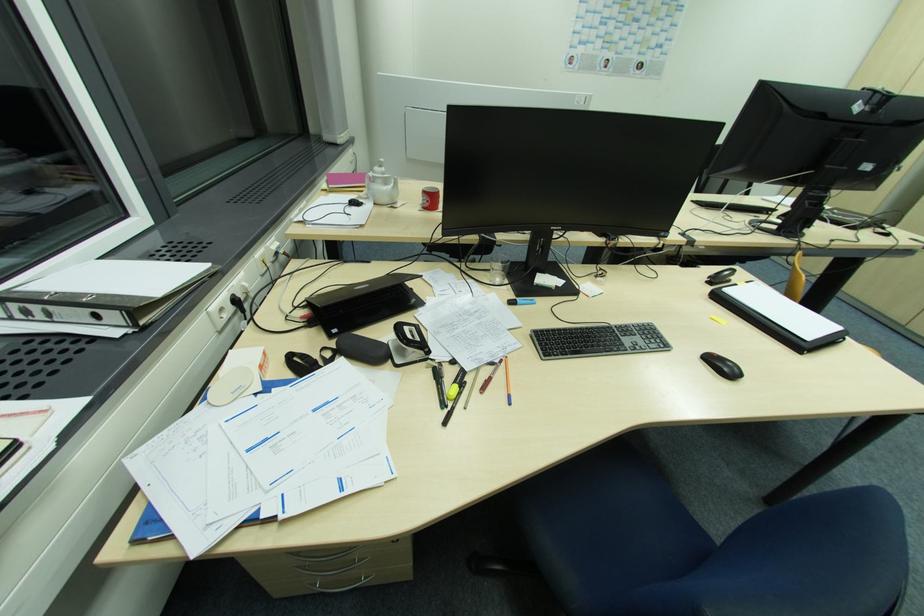
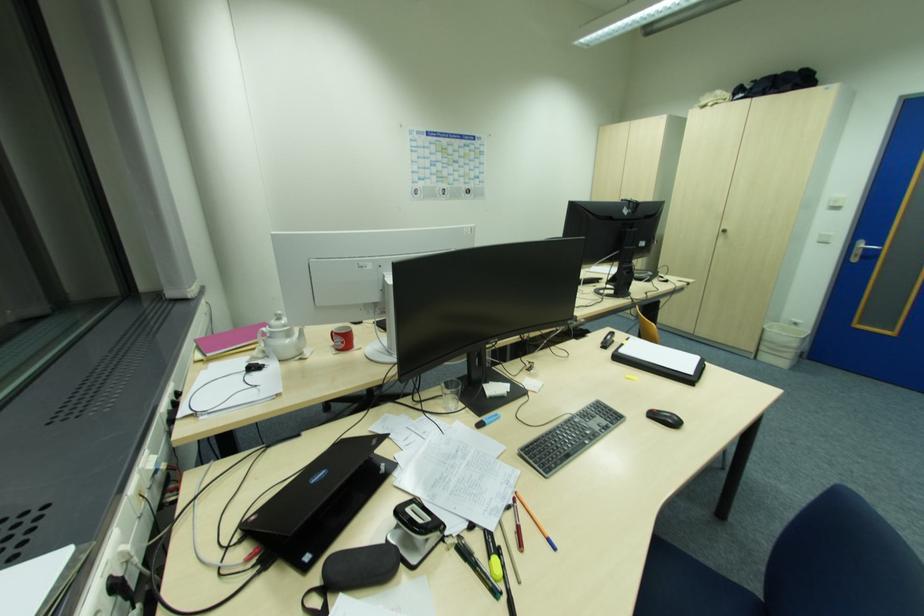
Question: How did the camera likely rotate?

Choices:
 (A) Left
 (B) Right
 (C) Up
 (D) Down

Answer: (B)